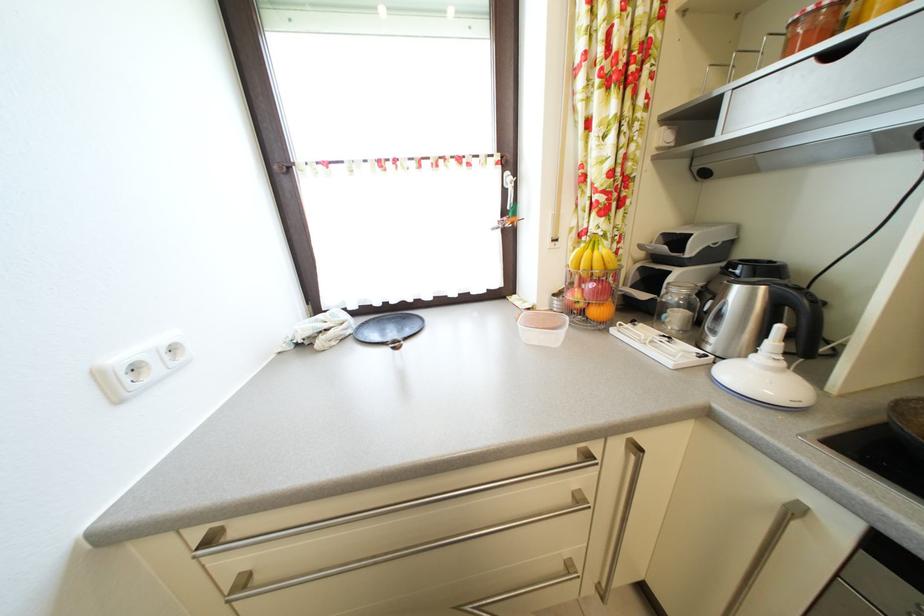
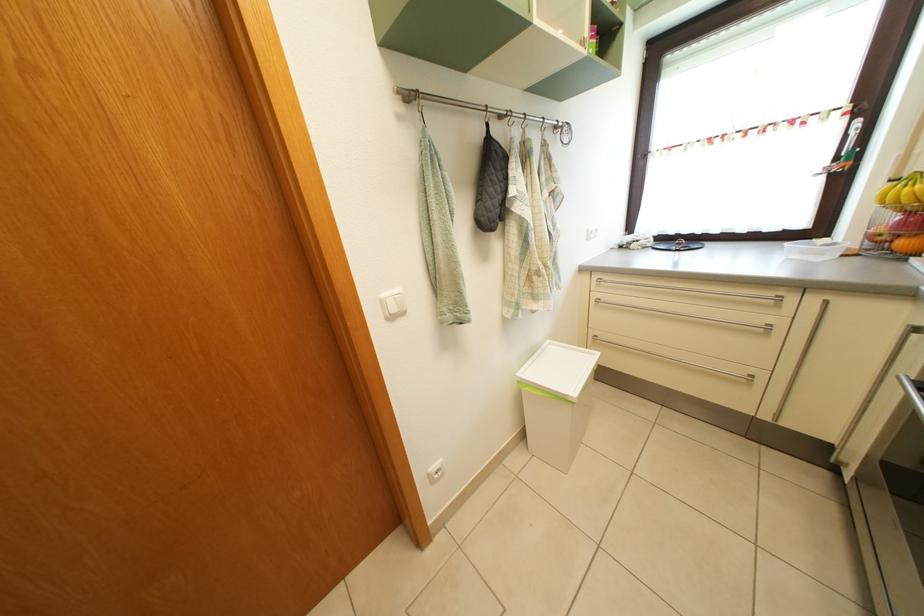
Find the pixel in the second image that matches point 513,199 in the first image.

(853, 146)